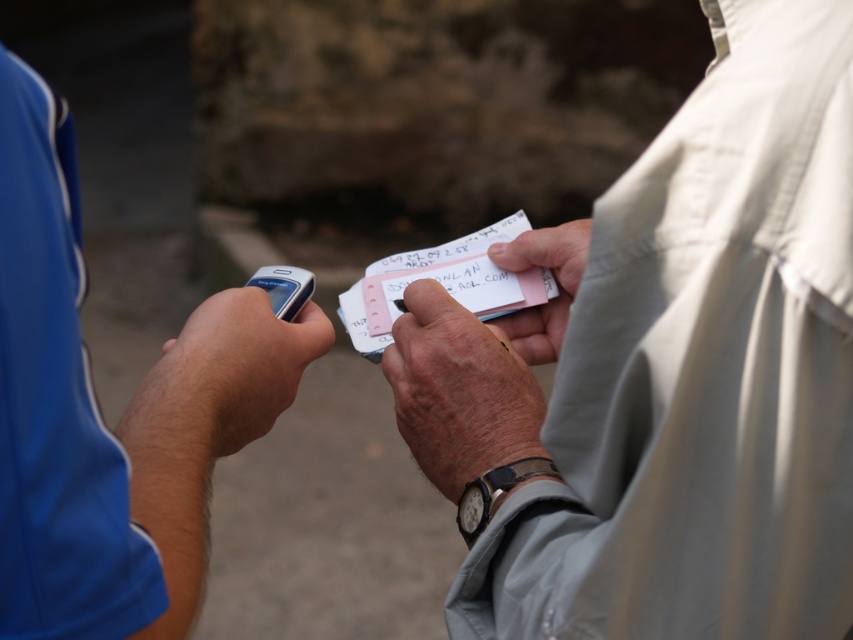
Where is the blue fabric shirt at left located in the image?

The blue fabric shirt at left is located at point coordinates of 0.645 on the x axis and 0.117 on the y axis.

From the picture: You are a delivery robot with a 4.5 inch wide package. You need to place it between the matte plastic phone at left and the slate gray plastic smartphone at left. Can you fit the package in the space between them?

The distance between the matte plastic phone at left and the slate gray plastic smartphone at left is 3.60 inches. Since the package is 4.5 inches wide, it cannot fit in the space between them.